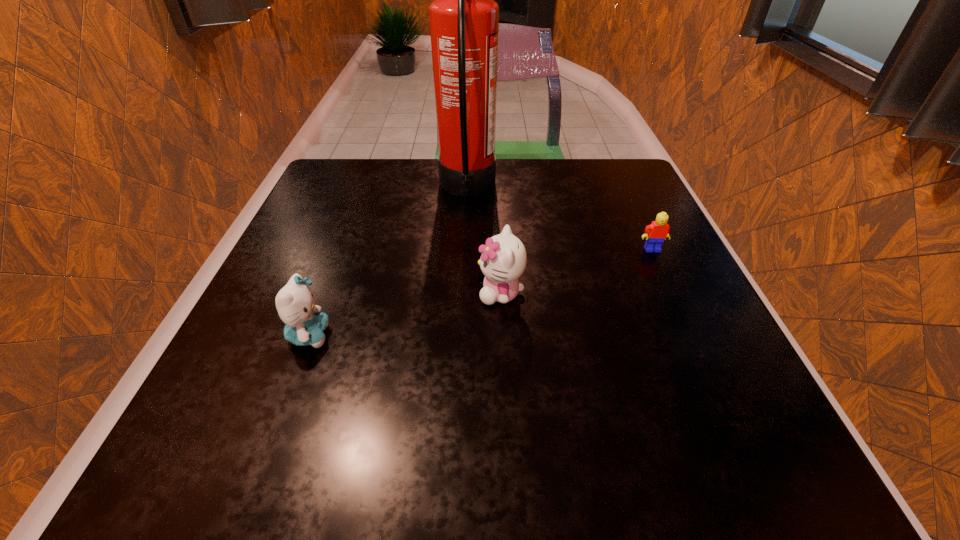
Where is `vacant area that lies between the left kitten and the right kitten`? The image size is (960, 540). vacant area that lies between the left kitten and the right kitten is located at coordinates (405, 314).

Locate which object ranks third in proximity to the farthest object. Please provide its 2D coordinates. Your answer should be formatted as a tuple, i.e. [(x, y)], where the tuple contains the x and y coordinates of a point satisfying the conditions above.

[(305, 324)]

You are a GUI agent. You are given a task and a screenshot of the screen. Output one action in this format:
    pyautogui.click(x=<x>, y=<y>)
    Task: Click on the object that ranks as the closest to the left kitten
    
    Given the screenshot: What is the action you would take?
    pyautogui.click(x=503, y=260)

Image resolution: width=960 pixels, height=540 pixels. Identify the location of vacant space that satisfies the following two spatial constraints: 1. on the front-facing side of the Lego; 2. on the front-facing side of the second nearest object. (672, 293).

This screenshot has height=540, width=960. Identify the location of blank space that satisfies the following two spatial constraints: 1. on the front-facing side of the Lego; 2. on the front-facing side of the right kitten. (672, 293).

What are the coordinates of `free point that satisfies the following two spatial constraints: 1. on the front-facing side of the rightmost object; 2. on the front-facing side of the farther kitten` in the screenshot? It's located at (672, 293).